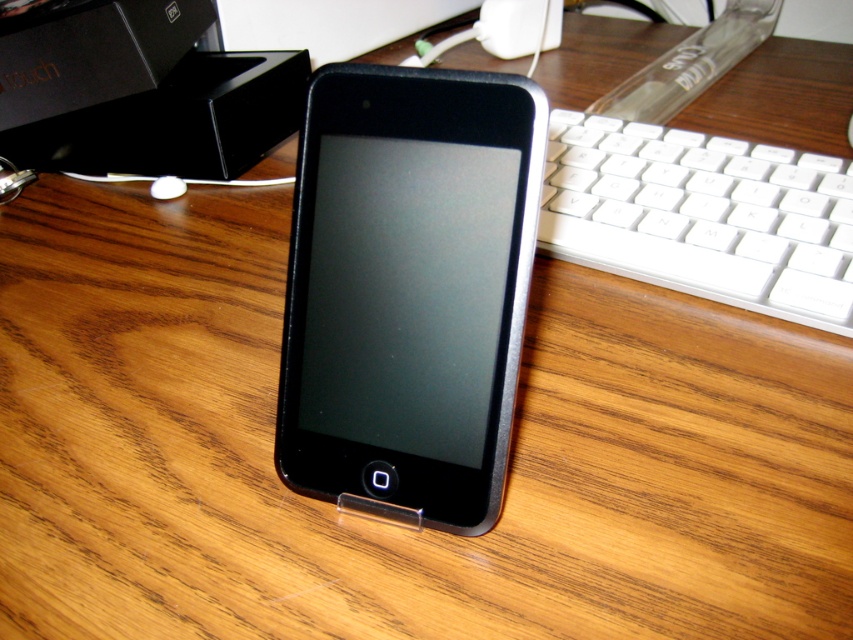
Is black matte smartphone at center to the left of white plastic keyboard at right from the viewer's perspective?

Correct, you'll find black matte smartphone at center to the left of white plastic keyboard at right.

In the scene shown: Does black matte smartphone at center lie in front of white plastic keyboard at right?

That is True.

Find the location of a particular element. Image resolution: width=853 pixels, height=640 pixels. black matte smartphone at center is located at coordinates (408, 289).

Where is `black matte smartphone at center`? Image resolution: width=853 pixels, height=640 pixels. black matte smartphone at center is located at coordinates (408, 289).